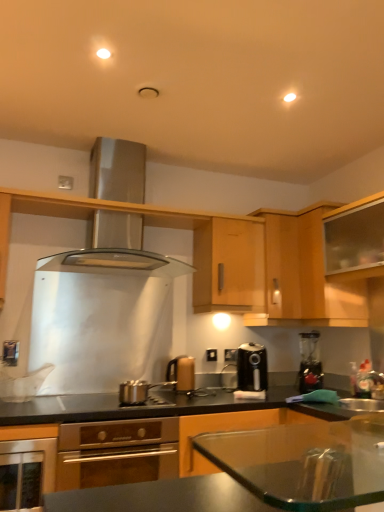
Where is `free space above satin silver exhaust hood at upper center (from a real-world perspective)`? The image size is (384, 512). free space above satin silver exhaust hood at upper center (from a real-world perspective) is located at coordinates (132, 139).